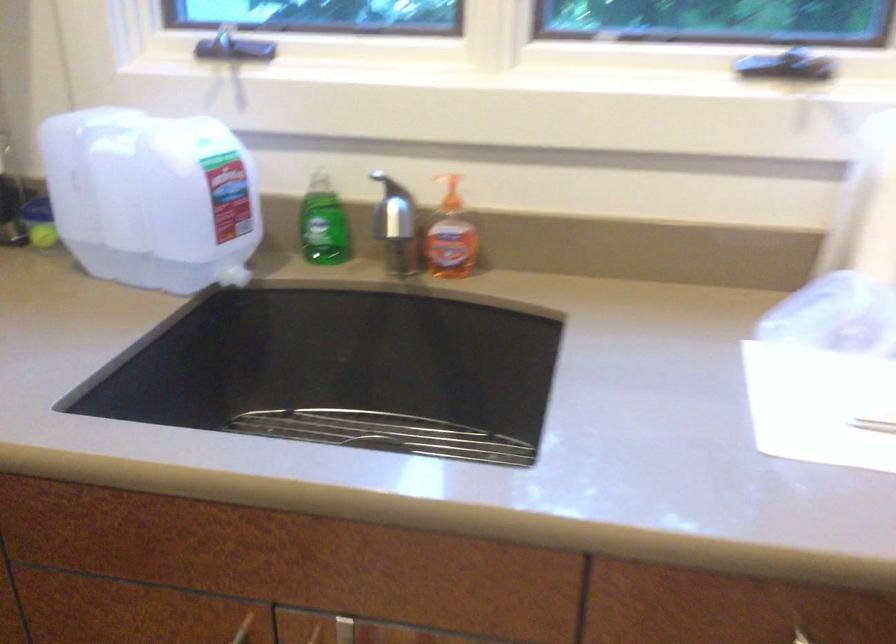
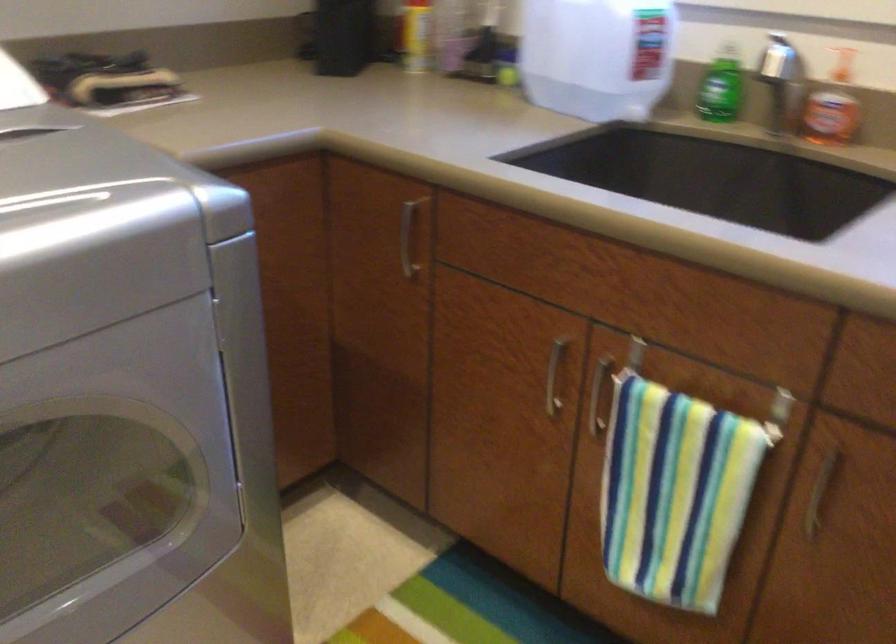
Where in the second image is the point corresponding to [325,222] from the first image?

(721, 88)